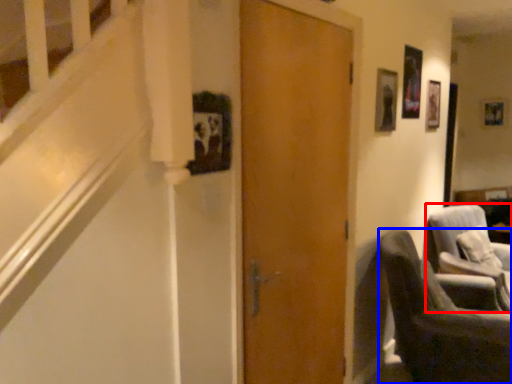
Question: Which object appears closest to the camera in this image, chair (highlighted by a red box) or chair (highlighted by a blue box)?

Choices:
 (A) chair
 (B) chair

Answer: (B)